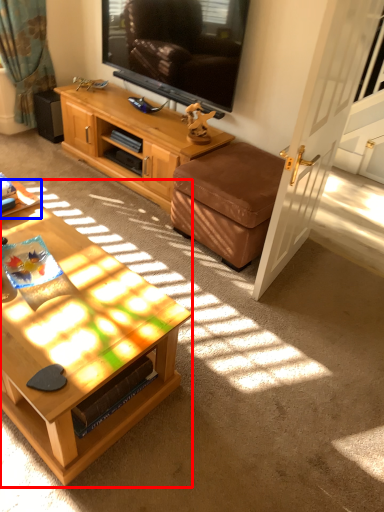
Question: Which point is closer to the camera, coffee table (highlighted by a red box) or desk (highlighted by a blue box)?

Choices:
 (A) coffee table
 (B) desk

Answer: (A)